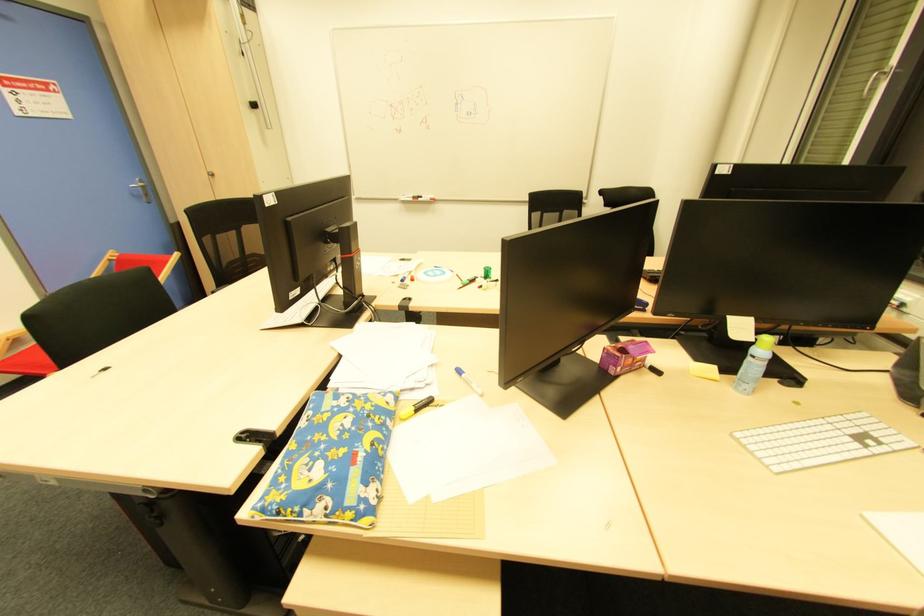
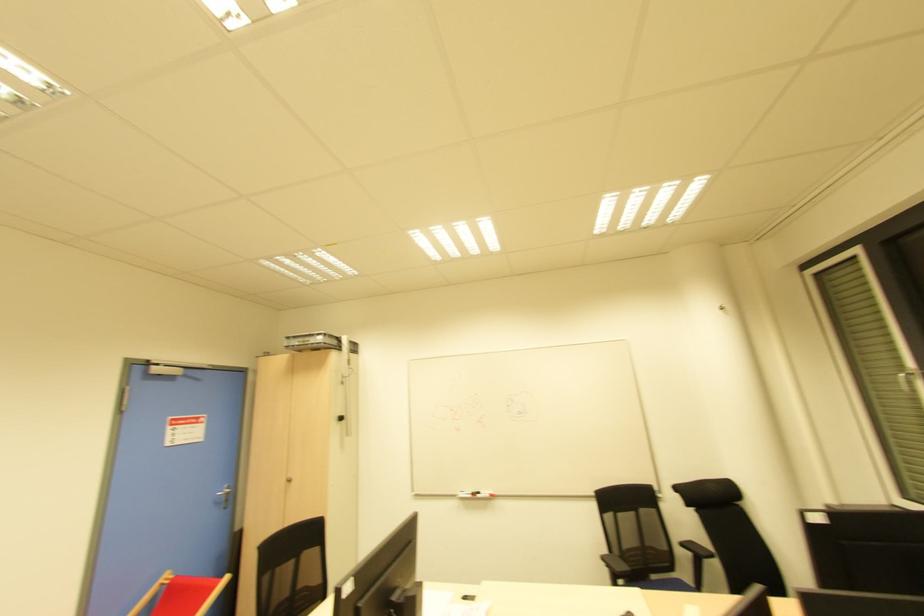
Where in the second image is the point corresponding to pixel 147 197 from the first image?

(225, 501)